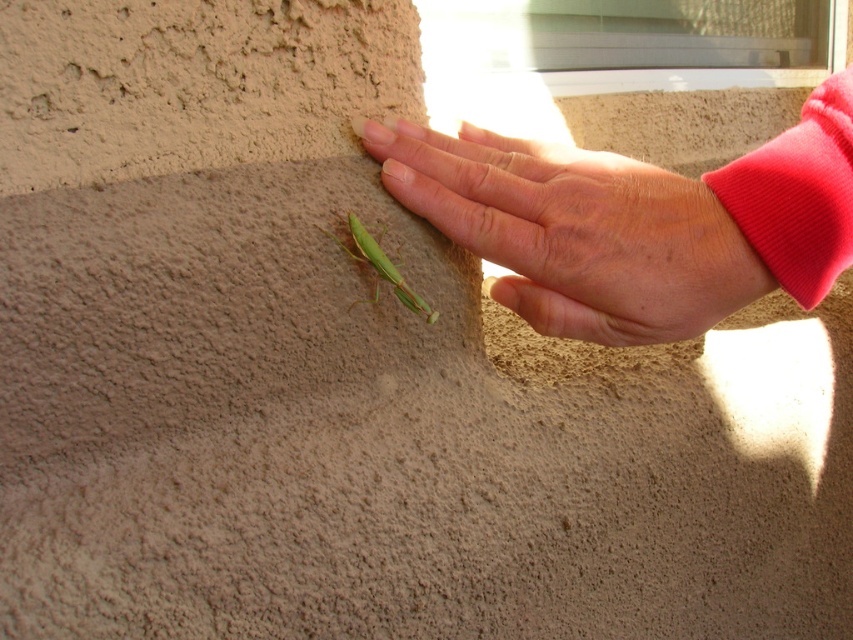
Question: Can you confirm if smooth skin hand at center is positioned to the right of green matte insect at center?

Choices:
 (A) no
 (B) yes

Answer: (B)

Question: Is smooth skin hand at center to the left of green matte insect at center from the viewer's perspective?

Choices:
 (A) yes
 (B) no

Answer: (B)

Question: From the image, what is the correct spatial relationship of smooth skin hand at center in relation to green matte insect at center?

Choices:
 (A) above
 (B) below

Answer: (A)

Question: Which point is farther to the camera?

Choices:
 (A) smooth skin hand at center
 (B) green matte insect at center

Answer: (B)

Question: Which point is closer to the camera taking this photo?

Choices:
 (A) (434, 312)
 (B) (560, 328)

Answer: (A)